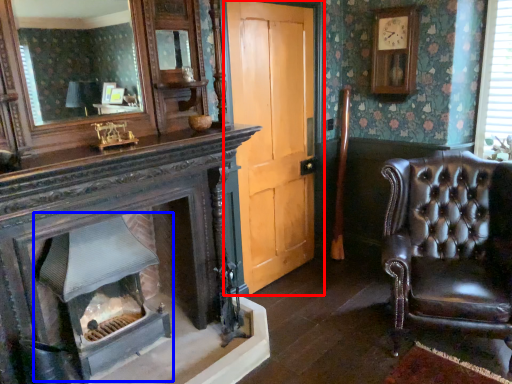
Question: Which object appears farthest to the camera in this image, door (highlighted by a red box) or fireplace (highlighted by a blue box)?

Choices:
 (A) door
 (B) fireplace

Answer: (A)